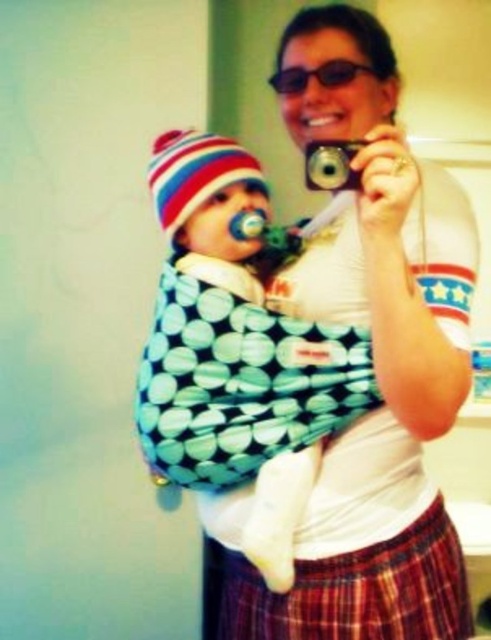
Is plaid fabric kilt at lower center below matte black sunglasses at upper center?

Yes, plaid fabric kilt at lower center is below matte black sunglasses at upper center.

The width and height of the screenshot is (491, 640). In order to click on plaid fabric kilt at lower center in this screenshot , I will do `click(347, 589)`.

The image size is (491, 640). What are the coordinates of `plaid fabric kilt at lower center` in the screenshot? It's located at (347, 589).

Does soft cotton baby carrier at center lie behind plaid fabric kilt at lower center?

Yes, soft cotton baby carrier at center is behind plaid fabric kilt at lower center.

Who is lower down, soft cotton baby carrier at center or plaid fabric kilt at lower center?

plaid fabric kilt at lower center is below.

Image resolution: width=491 pixels, height=640 pixels. Identify the location of soft cotton baby carrier at center. (239, 352).

Find the location of a particular element. soft cotton baby carrier at center is located at coordinates (239, 352).

How distant is soft cotton baby carrier at center from matte black sunglasses at upper center?

15.49 inches

Does soft cotton baby carrier at center come in front of matte black sunglasses at upper center?

Yes, it is in front of matte black sunglasses at upper center.

Between point (252, 176) and point (324, 83), which one is positioned in front?

Point (324, 83)

At what (x,y) coordinates should I click in order to perform the action: click on soft cotton baby carrier at center. Please return your answer as a coordinate pair (x, y). The height and width of the screenshot is (640, 491). Looking at the image, I should click on (239, 352).